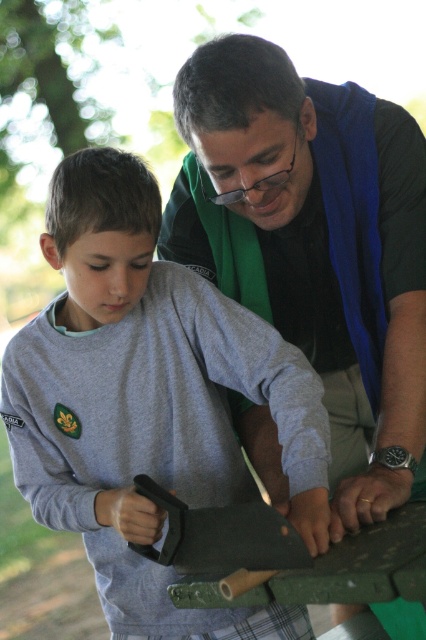
You are a fashion designer analyzing the clothing items in the image. Which clothing item, the gray cotton shirt at center or the blue fabric vest at center, has a shorter length?

The gray cotton shirt at center is shorter than the blue fabric vest at center.

You are a photographer trying to capture a candid shot of both the gray cotton shirt at center and the blue fabric vest at center in the scene. To ensure both are visible in the frame, should you position your camera to the left or the right of the two subjects?

Since the gray cotton shirt at center is to the left of the blue fabric vest at center, you should position your camera to the right of the two subjects to ensure both are visible in the frame.

You are a photographer taking a picture of the gray cotton shirt at center and the blue fabric vest at center. Which one will be more visible in the photo?

The gray cotton shirt at center will be more visible in the photo because the blue fabric vest at center is behind it.